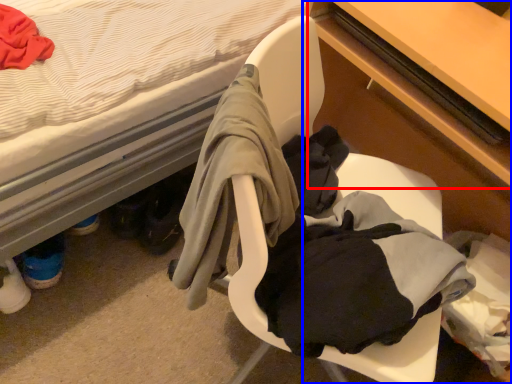
Question: Which of the following is the farthest to the observer, table (highlighted by a red box) or desk (highlighted by a blue box)?

Choices:
 (A) table
 (B) desk

Answer: (A)